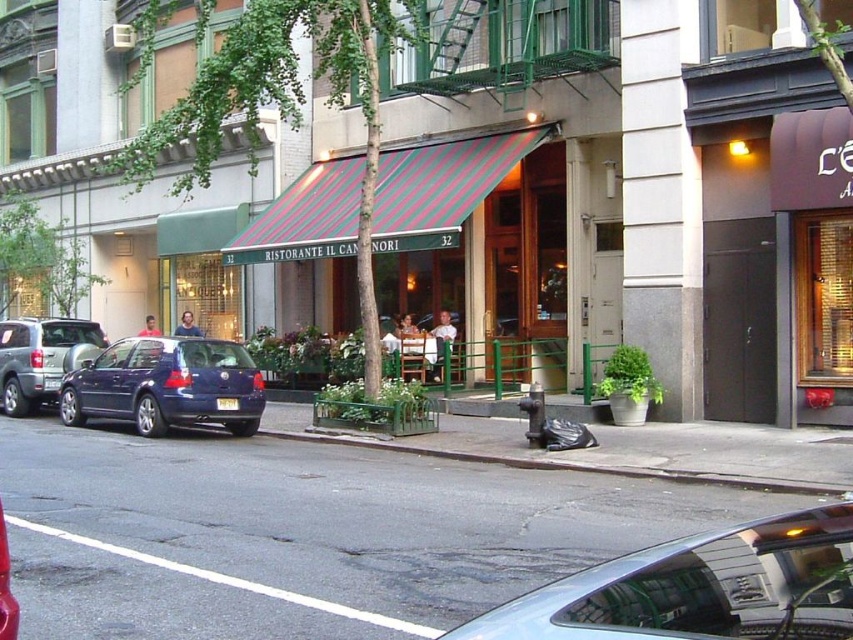
Between point (169, 387) and point (62, 336), which one is positioned behind?

Positioned behind is point (62, 336).

This screenshot has height=640, width=853. What do you see at coordinates (166, 385) in the screenshot? I see `metallic blue hatchback at left` at bounding box center [166, 385].

Locate an element on the screen. metallic blue hatchback at left is located at coordinates (166, 385).

Measure the distance between point (828, 524) and camera.

The distance of point (828, 524) from camera is 2.81 meters.

Is silver metallic car at center positioned before metallic blue hatchback at left?

Yes, it is.

This screenshot has width=853, height=640. I want to click on silver metallic car at center, so click(699, 588).

Where is `silver metallic car at center`? This screenshot has width=853, height=640. silver metallic car at center is located at coordinates (699, 588).

Does silver metallic car at center have a greater height compared to gray concrete curb at lower center?

Indeed, silver metallic car at center has a greater height compared to gray concrete curb at lower center.

Who is more forward, (686, 621) or (773, 490)?

Positioned in front is point (686, 621).

Where is `silver metallic car at center`? The width and height of the screenshot is (853, 640). silver metallic car at center is located at coordinates (699, 588).